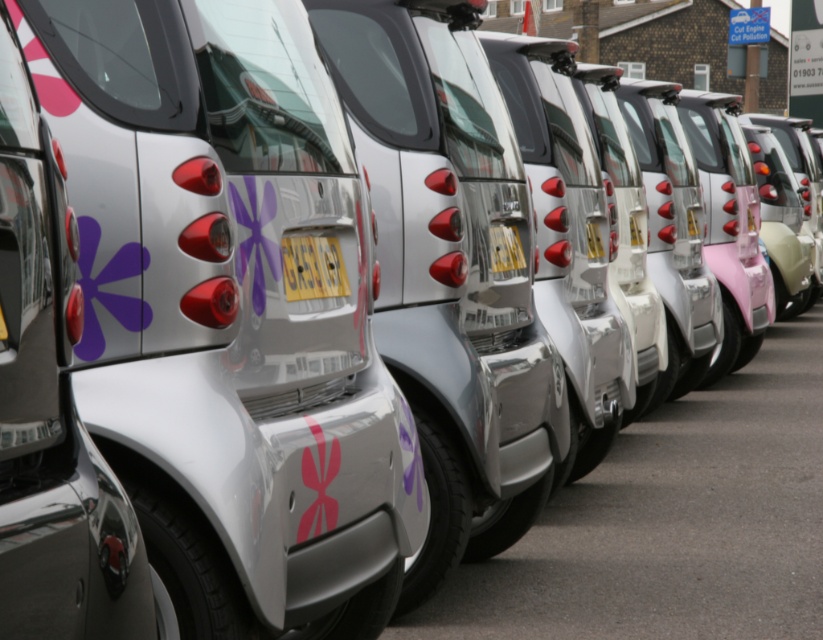
Can you confirm if metallic silver car at center is positioned above yellow matte license plate at center?

Actually, metallic silver car at center is below yellow matte license plate at center.

Can you confirm if metallic silver car at center is positioned to the right of yellow matte license plate at center?

In fact, metallic silver car at center is to the left of yellow matte license plate at center.

Does point (45, 476) come farther from viewer compared to point (284, 260)?

No, (45, 476) is in front of (284, 260).

Locate an element on the screen. The image size is (823, 640). metallic silver car at center is located at coordinates (50, 406).